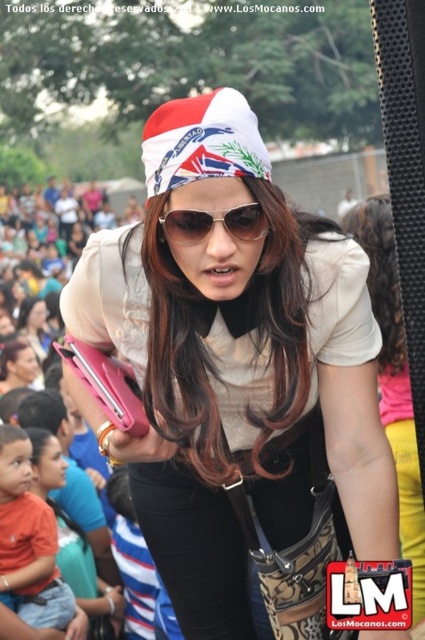
From the picture: Who is lower down, sunglasses at center or matte black phone at center?

matte black phone at center is below.

Between point (248, 240) and point (34, 296), which one is positioned in front?

Positioned in front is point (248, 240).

Identify the location of sunglasses at center. The image size is (425, 640). (214, 224).

Between white matte bandana at center and sunglasses at center, which one appears on the right side from the viewer's perspective?

white matte bandana at center is more to the right.

Who is more forward, [357,422] or [229,232]?

Point [229,232] is more forward.

This screenshot has height=640, width=425. What do you see at coordinates (238, 376) in the screenshot?
I see `white matte bandana at center` at bounding box center [238, 376].

Where is `white matte bandana at center`? This screenshot has width=425, height=640. white matte bandana at center is located at coordinates (238, 376).

Who is lower down, white matte bandana at center or white matte shirt at center?

white matte bandana at center is below.

Does white matte bandana at center lie in front of white matte shirt at center?

No, it is behind white matte shirt at center.

In the scene shown: Who is more forward, (118,332) or (387,221)?

Positioned in front is point (118,332).

This screenshot has height=640, width=425. I want to click on white matte bandana at center, so click(x=238, y=376).